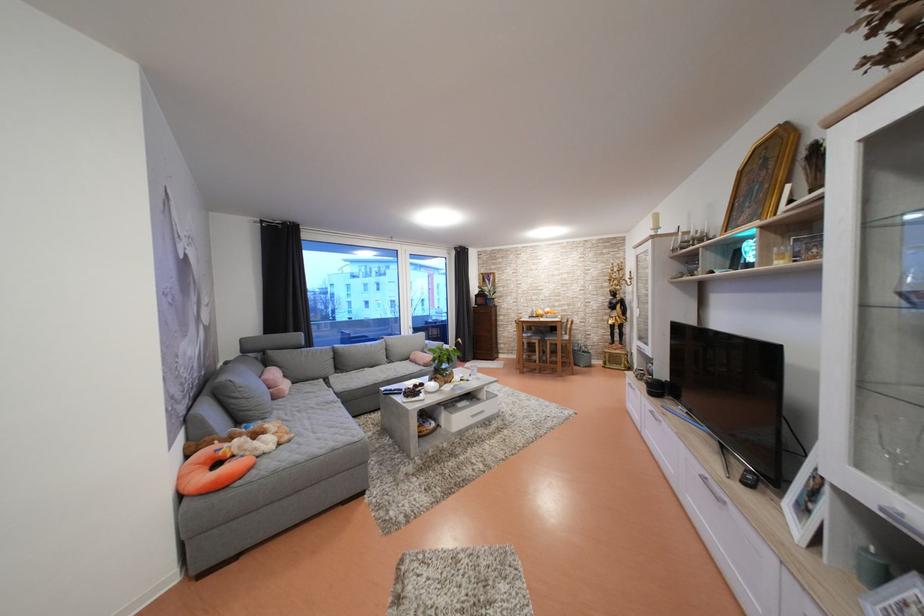
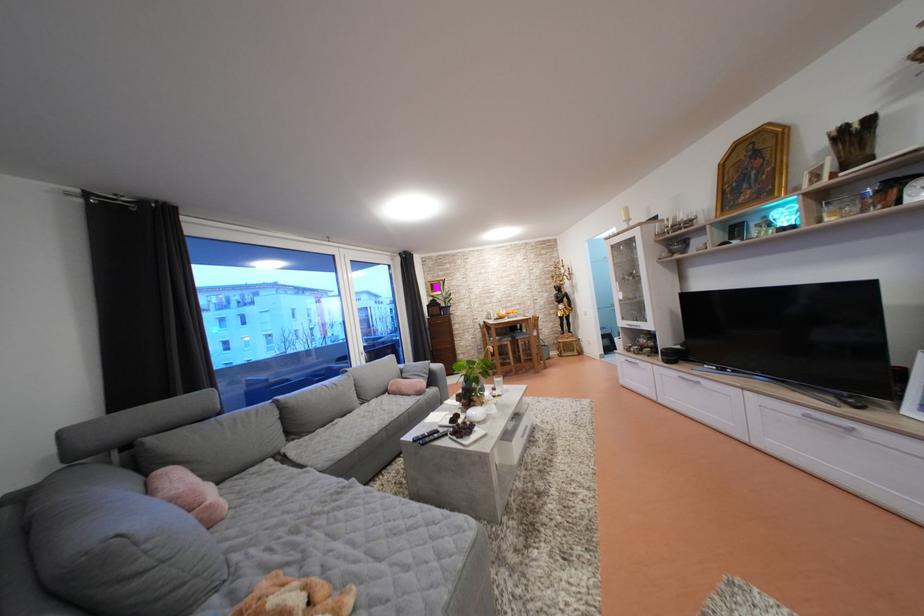
Where in the second image is the point corresponding to the point at 532,323 from the first image?

(497, 328)